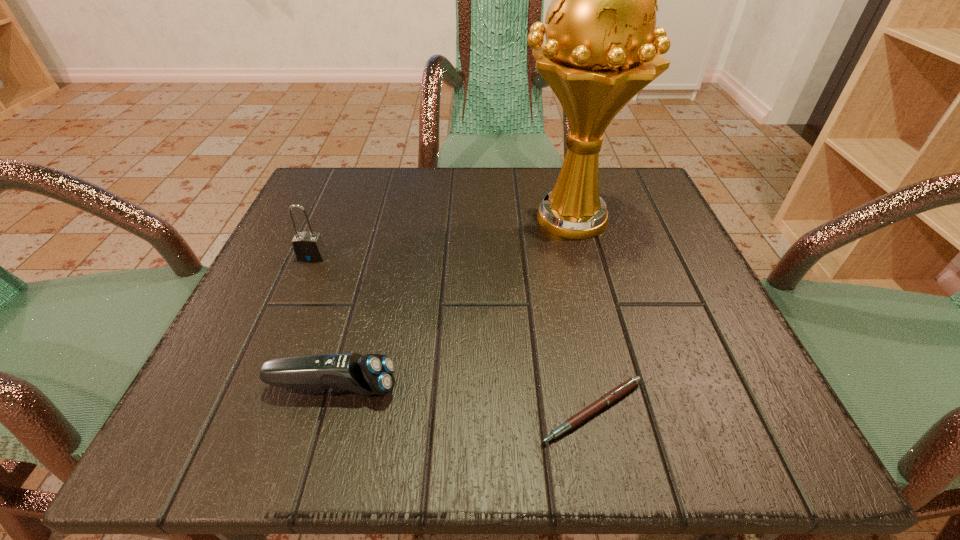
At what (x,y) coordinates should I click in order to perform the action: click on blank space at the near edge of the desktop. Please return your answer as a coordinate pair (x, y). Image resolution: width=960 pixels, height=540 pixels. Looking at the image, I should click on (340, 405).

Locate an element on the screen. free space at the left edge of the desktop is located at coordinates (298, 341).

Image resolution: width=960 pixels, height=540 pixels. In the image, there is a desktop. Identify the location of free space at the right edge. (633, 300).

Where is `free space at the far left corner of the desktop`? free space at the far left corner of the desktop is located at coordinates (340, 184).

In order to click on vacant space at the near left corner of the desktop in this screenshot , I will do `click(262, 434)`.

In the image, there is a desktop. Where is `vacant space at the near right corner`? The width and height of the screenshot is (960, 540). vacant space at the near right corner is located at coordinates (692, 424).

Locate an element on the screen. This screenshot has width=960, height=540. unoccupied area between the electric shaver and the padlock is located at coordinates (323, 322).

You are a GUI agent. You are given a task and a screenshot of the screen. Output one action in this format:
    pyautogui.click(x=<x>, y=<y>)
    Task: Click on the free space between the second shortest object and the padlock
    
    Given the screenshot: What is the action you would take?
    (323, 322)

The height and width of the screenshot is (540, 960). I want to click on free space between the padlock and the trophy_cup, so click(x=441, y=237).

The image size is (960, 540). Find the location of `unoccupied area between the tallest object and the shortest object`. unoccupied area between the tallest object and the shortest object is located at coordinates (581, 314).